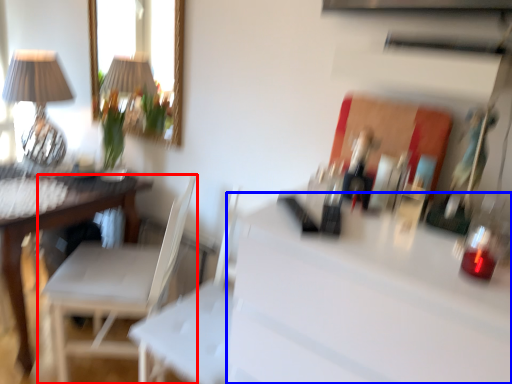
Question: Which of the following is the closest to the observer, chair (highlighted by a red box) or counter top (highlighted by a blue box)?

Choices:
 (A) chair
 (B) counter top

Answer: (B)